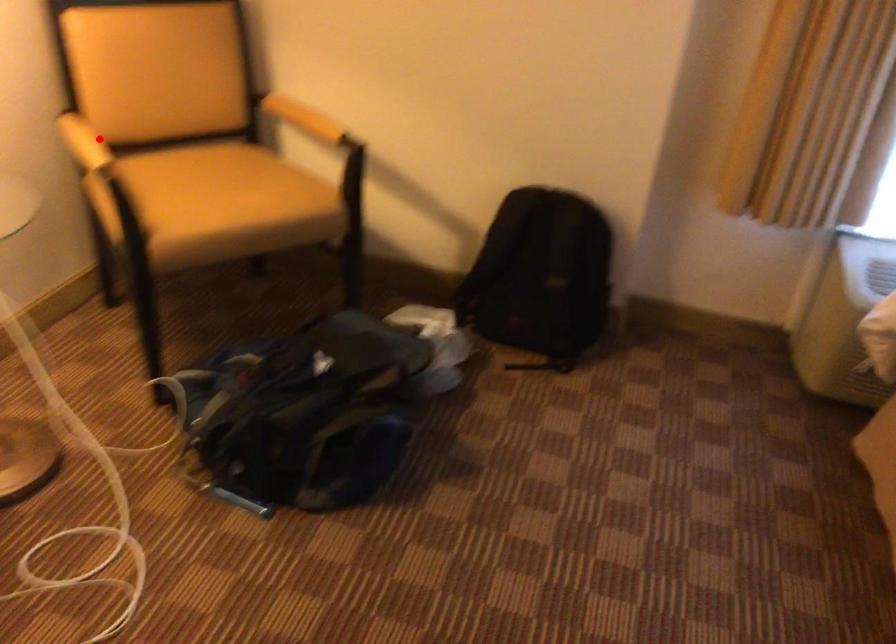
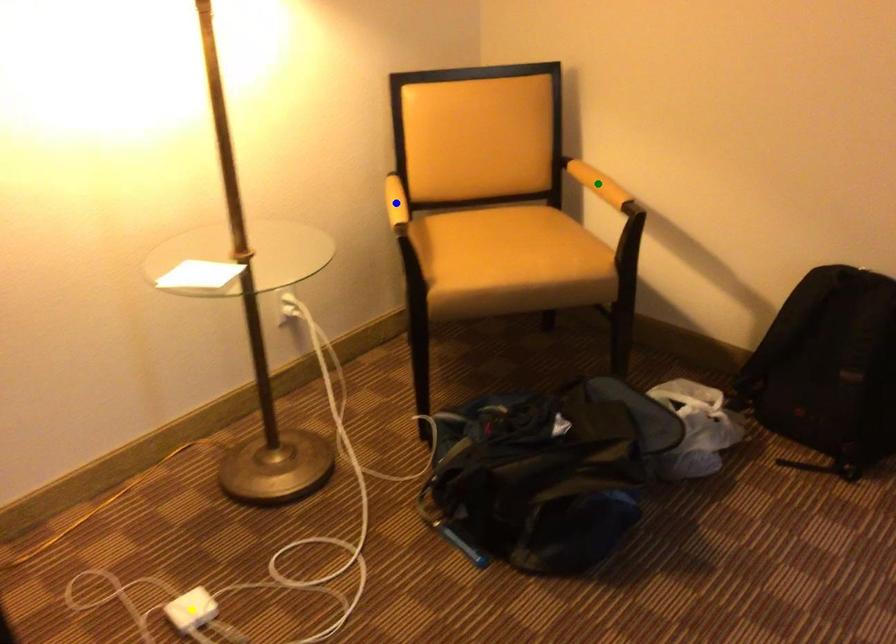
Question: I am providing you with two images of the same scene from different viewpoints. A red point is marked on the first image. You are given multiple points on the second image. Which point in image 2 represents the same 3d spot as the red point in image 1?

Choices:
 (A) yellow point
 (B) green point
 (C) blue point

Answer: (C)